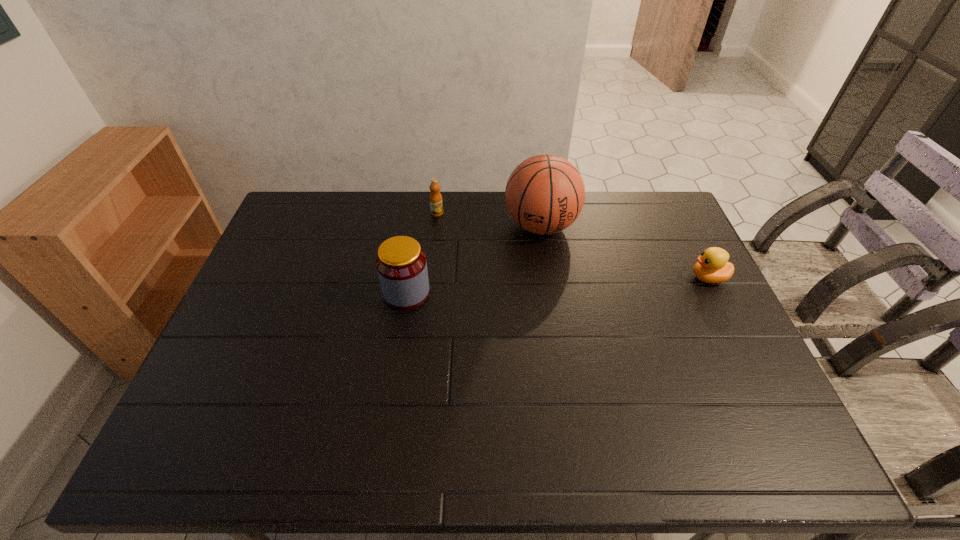
In the image, there is a desktop. At what (x,y) coordinates should I click in order to perform the action: click on free region at the near edge. Please return your answer as a coordinate pair (x, y). The width and height of the screenshot is (960, 540). Looking at the image, I should click on (601, 404).

In the image, there is a desktop. Where is `vacant space at the left edge`? The height and width of the screenshot is (540, 960). vacant space at the left edge is located at coordinates (275, 349).

I want to click on vacant space at the right edge, so click(686, 330).

This screenshot has width=960, height=540. In the image, there is a desktop. What are the coordinates of `vacant area at the far left corner` in the screenshot? It's located at (310, 192).

At what (x,y) coordinates should I click in order to perform the action: click on vacant region at the near right corner. Please return your answer as a coordinate pair (x, y). This screenshot has height=540, width=960. Looking at the image, I should click on (760, 388).

The image size is (960, 540). Find the location of `vacant region between the basketball and the orange juice`. vacant region between the basketball and the orange juice is located at coordinates (489, 219).

The height and width of the screenshot is (540, 960). What are the coordinates of `unoccupied area between the third object from left to right and the rightmost object` in the screenshot? It's located at (625, 252).

This screenshot has height=540, width=960. Identify the location of unoccupied area between the second shortest object and the duckling. (572, 246).

This screenshot has width=960, height=540. Identify the location of unoccupied area between the basketball and the shortest object. (625, 252).

The width and height of the screenshot is (960, 540). In order to click on empty space between the rightmost object and the second shortest object in this screenshot , I will do `click(572, 246)`.